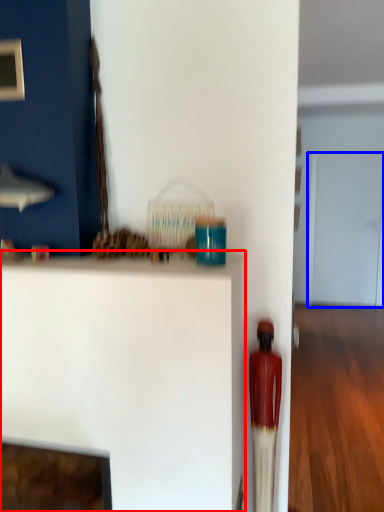
Question: Which object appears farthest to the camera in this image, furniture (highlighted by a red box) or glass door (highlighted by a blue box)?

Choices:
 (A) furniture
 (B) glass door

Answer: (B)